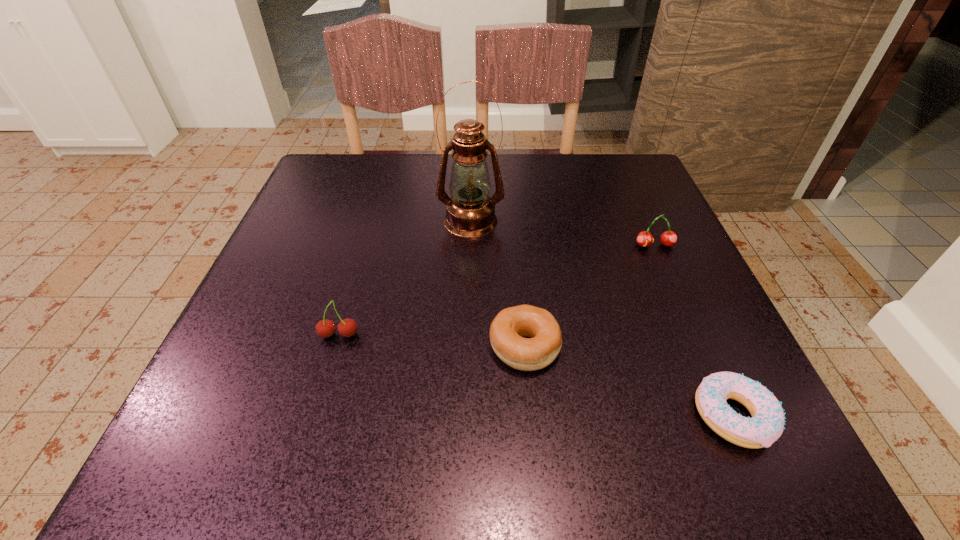
Where is `free space located 0.350m with stems pointing upwards on the right cherry`? The image size is (960, 540). free space located 0.350m with stems pointing upwards on the right cherry is located at coordinates (729, 412).

You are a GUI agent. You are given a task and a screenshot of the screen. Output one action in this format:
    pyautogui.click(x=<x>, y=<y>)
    Task: Click on the free space located 0.160m on the right of the bagel
    This screenshot has height=540, width=960.
    Given the screenshot: What is the action you would take?
    pyautogui.click(x=660, y=346)

I want to click on vacant space located on the back of the nearest object, so click(x=694, y=330).

The image size is (960, 540). I want to click on object positioned at the far edge, so click(x=470, y=212).

The image size is (960, 540). I want to click on object positioned at the near edge, so click(767, 423).

This screenshot has height=540, width=960. I want to click on object located at the left edge, so click(x=326, y=328).

Where is `cherry located at the right edge`? cherry located at the right edge is located at coordinates (669, 238).

Identify the location of doughnut that is at the right edge. (767, 423).

You are a GUI agent. You are given a task and a screenshot of the screen. Output one action in this format:
    pyautogui.click(x=<x>, y=<y>)
    Task: Click on the object at the near right corner
    
    Given the screenshot: What is the action you would take?
    pyautogui.click(x=767, y=423)

The image size is (960, 540). In the image, there is a desktop. What are the coordinates of `vacant region at the far edge` in the screenshot? It's located at (573, 163).